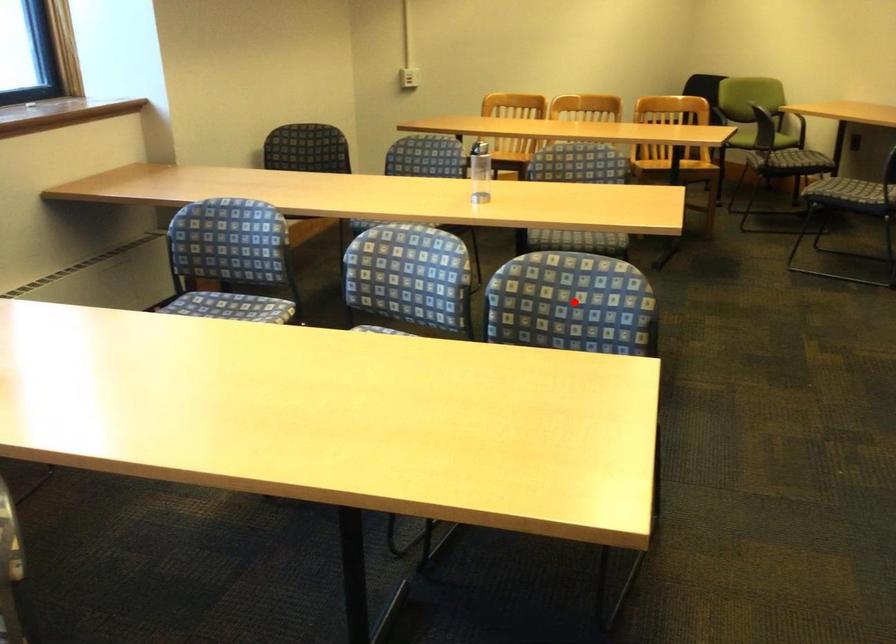
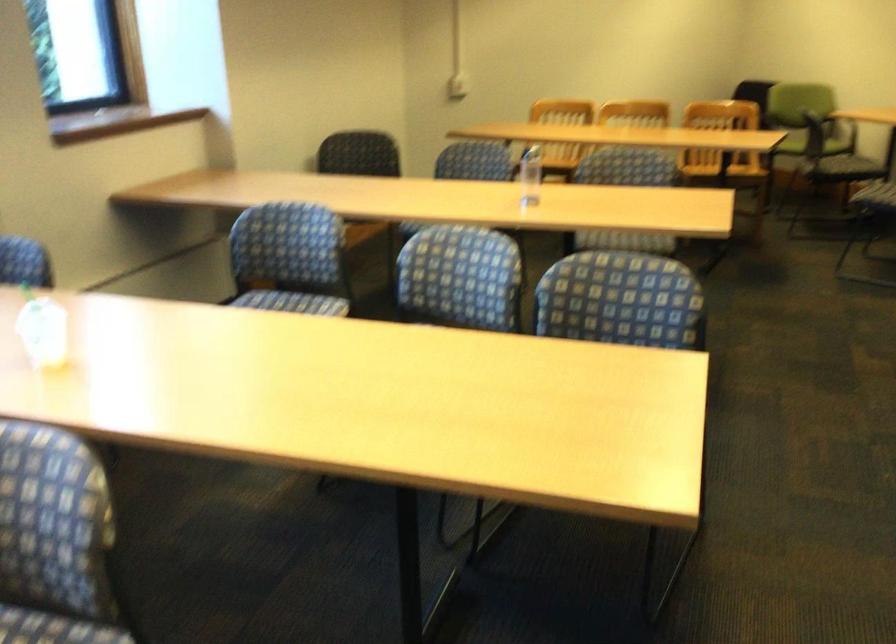
Find the pixel in the second image that matches the highlighted location in the first image.

(622, 301)